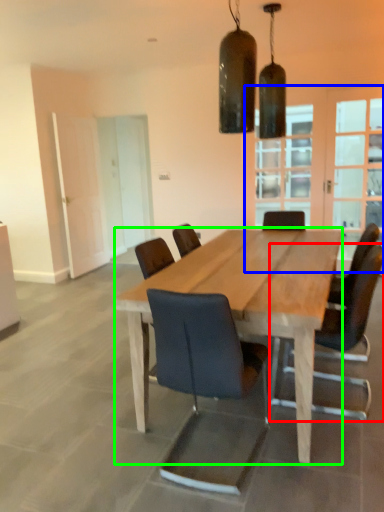
Question: Which is farther away from chair (highlighted by a red box)? glass door (highlighted by a blue box) or kitchen & dining room table (highlighted by a green box)?

Choices:
 (A) glass door
 (B) kitchen & dining room table

Answer: (A)